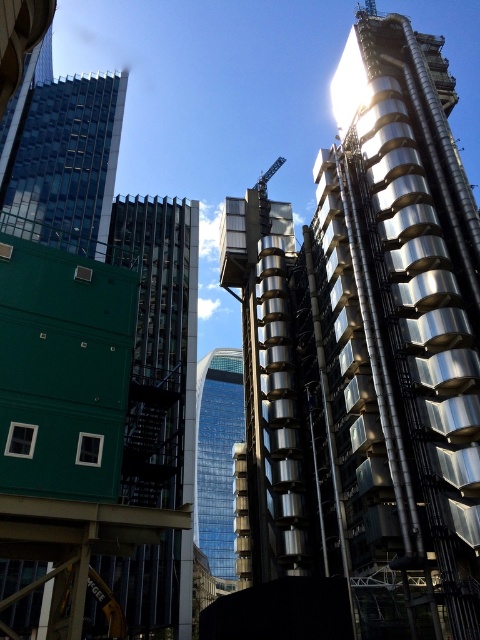
The width and height of the screenshot is (480, 640). Describe the element at coordinates (370, 353) in the screenshot. I see `metallic silver building at center` at that location.

Which of these two, metallic silver building at center or transparent glass skyscraper at center, stands taller?

metallic silver building at center is taller.

What do you see at coordinates (370, 353) in the screenshot?
I see `metallic silver building at center` at bounding box center [370, 353].

Where is `metallic silver building at center`? The image size is (480, 640). metallic silver building at center is located at coordinates (370, 353).